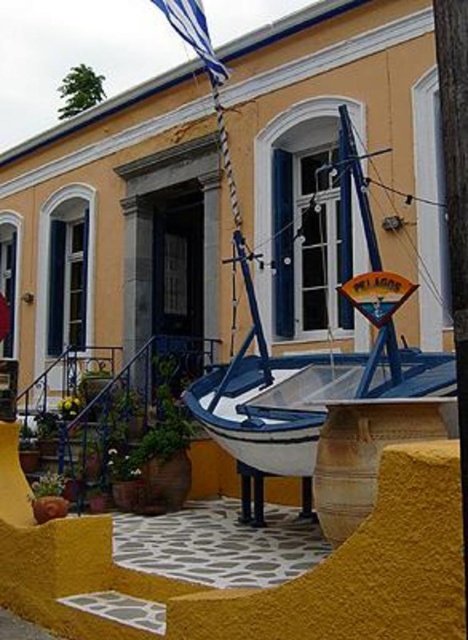
Is smooth wooden pole at center closer to camera compared to blue fabric flag at upper center?

Yes, smooth wooden pole at center is closer to the viewer.

Between point (467, 532) and point (174, 8), which one is positioned in front?

Positioned in front is point (467, 532).

Does point (441, 0) come farther from viewer compared to point (202, 28)?

No, (441, 0) is in front of (202, 28).

Where is `smooth wooden pole at center`? Image resolution: width=468 pixels, height=640 pixels. smooth wooden pole at center is located at coordinates (455, 205).

The image size is (468, 640). What do you see at coordinates (299, 392) in the screenshot? I see `blue painted wood boat at center` at bounding box center [299, 392].

Who is more forward, [212,422] or [216,77]?

Point [212,422] is in front.

Locate an element on the screen. The width and height of the screenshot is (468, 640). blue painted wood boat at center is located at coordinates (299, 392).

Can you confirm if blue painted wood boat at center is bigger than smooth wooden pole at center?

Yes.

From the picture: Can you confirm if blue painted wood boat at center is thinner than smooth wooden pole at center?

No, blue painted wood boat at center is not thinner than smooth wooden pole at center.

This screenshot has height=640, width=468. What do you see at coordinates (299, 392) in the screenshot?
I see `blue painted wood boat at center` at bounding box center [299, 392].

The width and height of the screenshot is (468, 640). Identify the location of blue painted wood boat at center. (299, 392).